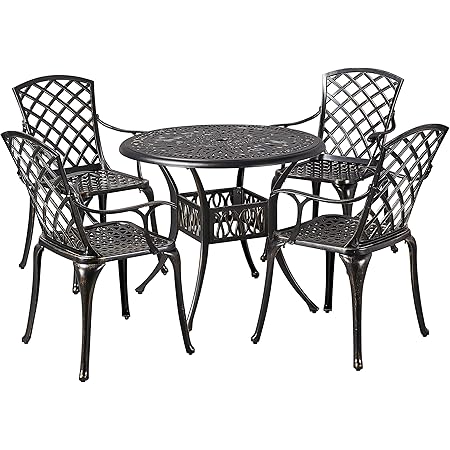
The image size is (450, 450). Find the location of `back chair legs`. back chair legs is located at coordinates (357, 342), (423, 311), (396, 250), (318, 184), (34, 232), (106, 199), (34, 298), (93, 320).